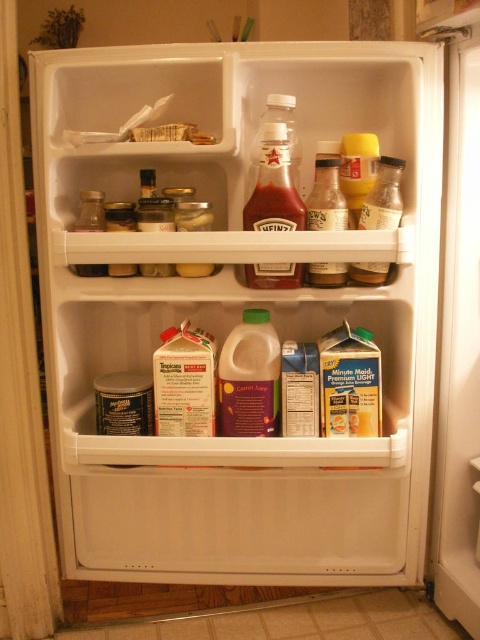
Question: Does translucent plastic bottle at center have a lesser width compared to clear glass jar at center?

Choices:
 (A) no
 (B) yes

Answer: (A)

Question: Which point is closer to the camera?

Choices:
 (A) matte glass bottle of ketchup at center
 (B) translucent glass bottles at center

Answer: (A)

Question: Estimate the real-world distances between objects in this image. Which object is farther from the matte glass bottle of ketchup at center?

Choices:
 (A) white plastic door at lower right
 (B) clear glass jar at center

Answer: (A)

Question: Observing the image, what is the correct spatial positioning of translucent plastic bottle at center in reference to clear glass jar at center?

Choices:
 (A) left
 (B) right

Answer: (B)

Question: Among these points, which one is nearest to the camera?

Choices:
 (A) (475, 369)
 (B) (396, 186)

Answer: (B)

Question: Is matte glass bottle of ketchup at center further to camera compared to clear glass jar at center?

Choices:
 (A) no
 (B) yes

Answer: (A)